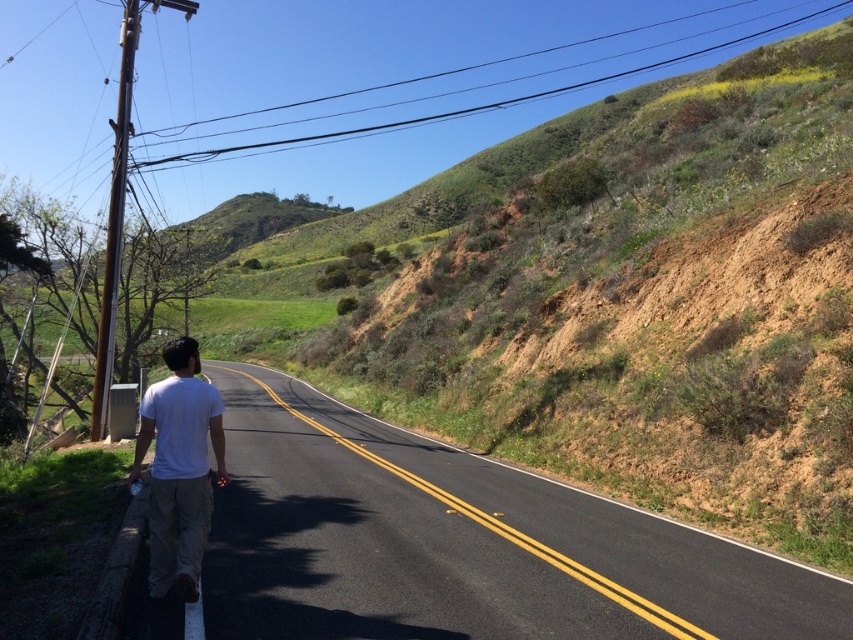
You are a pedestrian standing at the center of the black asphalt highway at center and the white cotton shirt at center. Which object is larger in size?

The black asphalt highway at center is bigger than the white cotton shirt at center.

You are a pedestrian standing on the road and see the black asphalt highway at center and the white cotton shirt at center. Which object is located to the right side of the other?

The black asphalt highway at center is positioned on the right side of white cotton shirt at center.